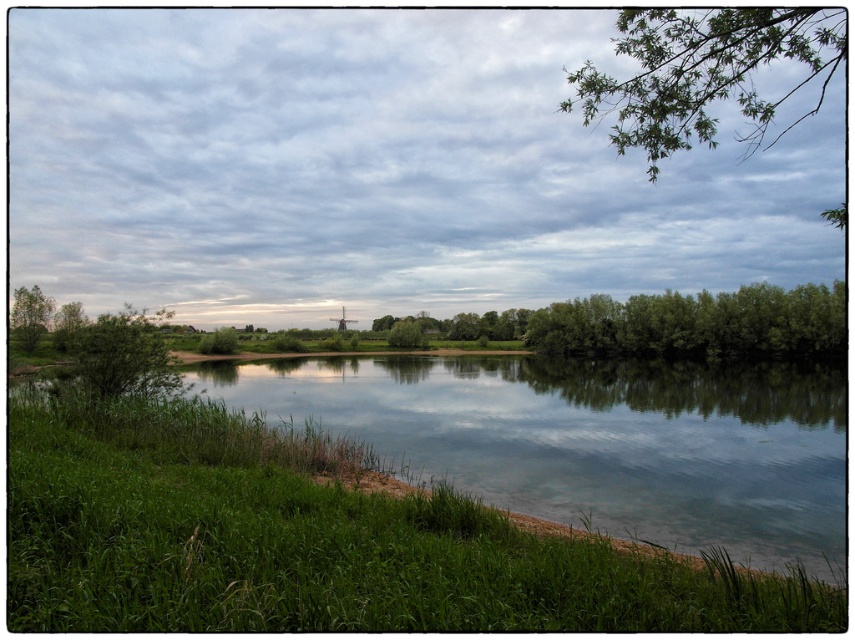
Question: Does green leafy trees at center have a larger size compared to green leafy tree at center?

Choices:
 (A) yes
 (B) no

Answer: (A)

Question: Can you confirm if green leafy branch at upper right is smaller than green leafy tree at center?

Choices:
 (A) no
 (B) yes

Answer: (A)

Question: Which point appears farthest from the camera in this image?

Choices:
 (A) (408, 333)
 (B) (638, 90)

Answer: (A)

Question: Is green leafy trees at center thinner than green leafy tree at center?

Choices:
 (A) no
 (B) yes

Answer: (A)

Question: Estimate the real-world distances between objects in this image. Which object is closer to the green leafy trees at center?

Choices:
 (A) green leafy tree at left
 (B) green leafy branch at upper right
 (C) green leafy bush at left

Answer: (B)

Question: Which point is closer to the camera?

Choices:
 (A) green leafy trees at center
 (B) green leafy tree at center

Answer: (A)